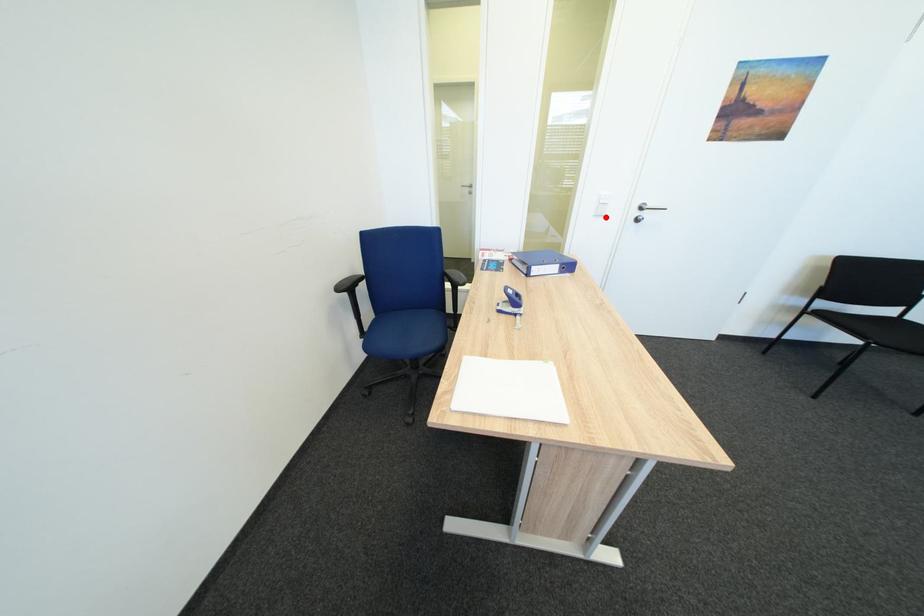
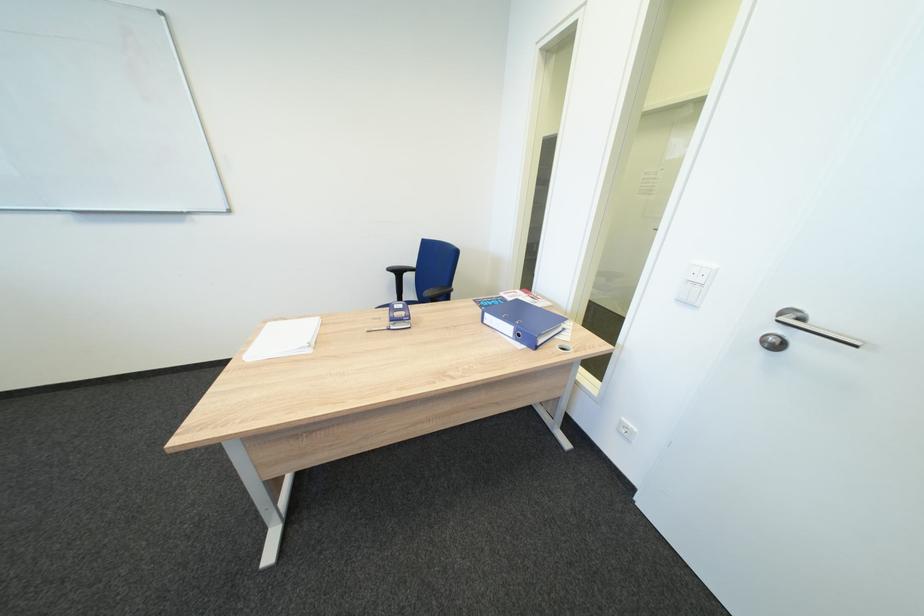
In the second image, find the point that corresponds to the highlighted location in the first image.

(687, 302)